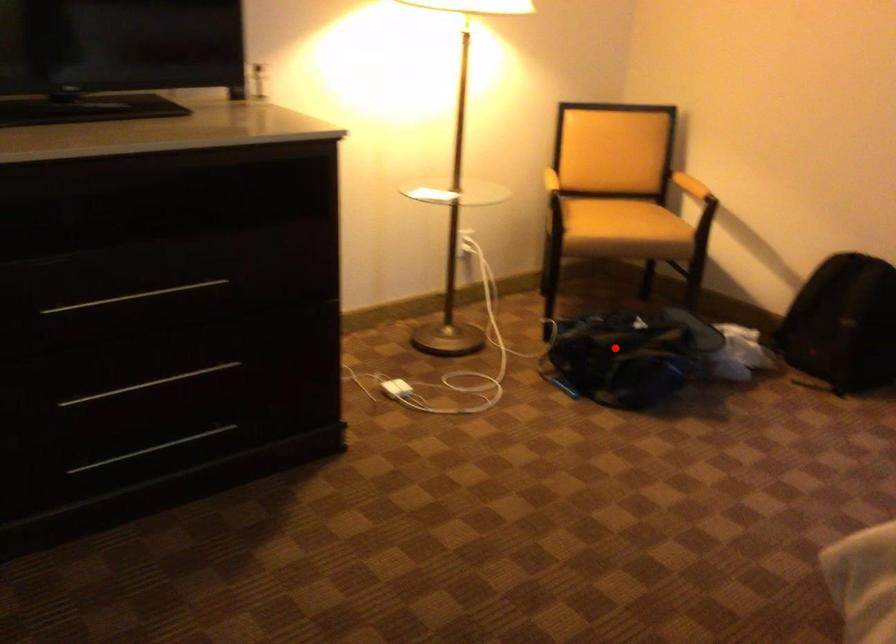
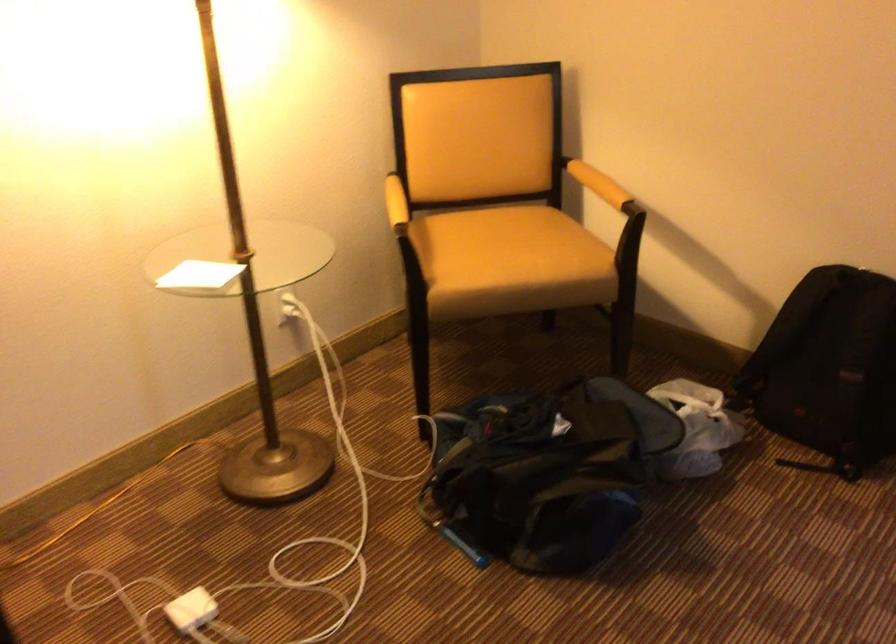
Question: A red point is marked in image1. In image2, is the corresponding 3D point closer to the camera or farther? Reply with the corresponding letter.

Choices:
 (A) The corresponding 3D point is closer.
 (B) The corresponding 3D point is farther.

Answer: (A)